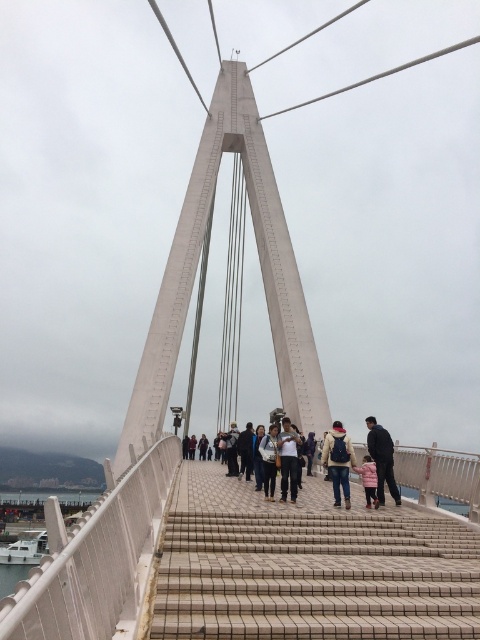
Can you confirm if beige brick stairs at center is positioned above light brown leather jacket at center?

Correct, beige brick stairs at center is located above light brown leather jacket at center.

Between beige brick stairs at center and light brown leather jacket at center, which one appears on the left side from the viewer's perspective?

From the viewer's perspective, light brown leather jacket at center appears more on the left side.

Is point (249, 557) positioned in front of point (356, 452)?

Yes, point (249, 557) is closer to viewer.

I want to click on beige brick stairs at center, so click(x=315, y=577).

Describe the element at coordinates (338, 460) in the screenshot. The image size is (480, 640). I see `white fleece jacket at center` at that location.

This screenshot has height=640, width=480. Identify the location of white fleece jacket at center. (338, 460).

Is point (280, 449) less distant than point (273, 472)?

No.

Can you confirm if dark gray pants at center is positioned below dark gray fabric jacket at center?

Actually, dark gray pants at center is above dark gray fabric jacket at center.

Is point (286, 477) more distant than point (274, 499)?

Yes, it is.

Find the location of a particular element. Image resolution: width=480 pixels, height=640 pixels. dark gray pants at center is located at coordinates (288, 460).